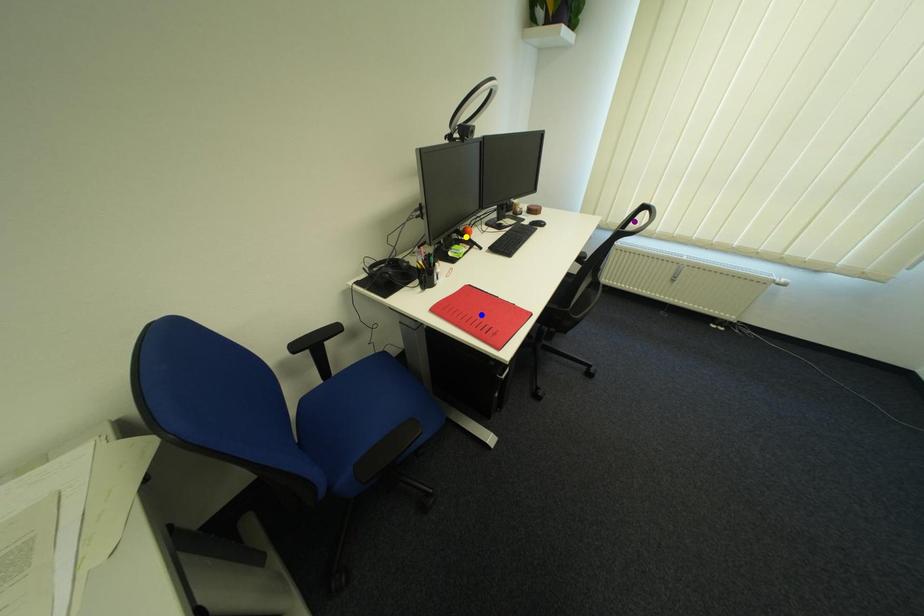
Order these from nearest to farthest:
yellow point | blue point | purple point

1. blue point
2. yellow point
3. purple point